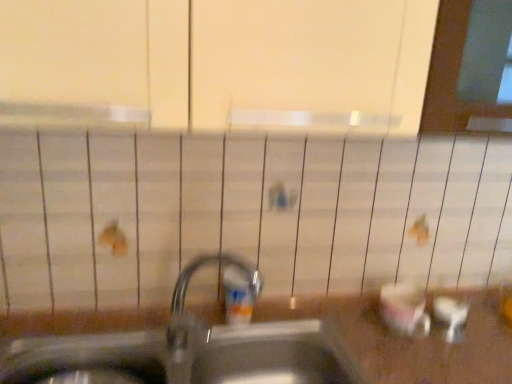
Question: From the image's perspective, is metallic sink at center over translucent plastic soap dispenser at center?

Choices:
 (A) yes
 (B) no

Answer: (B)

Question: From a real-world perspective, is metallic sink at center beneath translucent plastic soap dispenser at center?

Choices:
 (A) no
 (B) yes

Answer: (B)

Question: Is metallic sink at center thinner than translucent plastic soap dispenser at center?

Choices:
 (A) yes
 (B) no

Answer: (B)

Question: Does metallic sink at center have a smaller size compared to translucent plastic soap dispenser at center?

Choices:
 (A) yes
 (B) no

Answer: (B)

Question: Is metallic sink at center in front of translucent plastic soap dispenser at center?

Choices:
 (A) no
 (B) yes

Answer: (B)

Question: Is metallic sink at center far from translucent plastic soap dispenser at center?

Choices:
 (A) yes
 (B) no

Answer: (B)

Question: Can you confirm if translucent plastic soap dispenser at center is taller than metallic sink at center?

Choices:
 (A) yes
 (B) no

Answer: (B)

Question: Can you confirm if translucent plastic soap dispenser at center is positioned to the left of metallic sink at center?

Choices:
 (A) no
 (B) yes

Answer: (A)

Question: From a real-world perspective, is translucent plastic soap dispenser at center beneath metallic sink at center?

Choices:
 (A) yes
 (B) no

Answer: (B)

Question: Can you confirm if translucent plastic soap dispenser at center is wider than metallic sink at center?

Choices:
 (A) yes
 (B) no

Answer: (B)

Question: Is translucent plastic soap dispenser at center positioned before metallic sink at center?

Choices:
 (A) no
 (B) yes

Answer: (A)

Question: Is metallic sink at center at the back of translucent plastic soap dispenser at center?

Choices:
 (A) no
 (B) yes

Answer: (A)

Question: In terms of size, does metallic sink at center appear bigger or smaller than translucent plastic soap dispenser at center?

Choices:
 (A) small
 (B) big

Answer: (B)